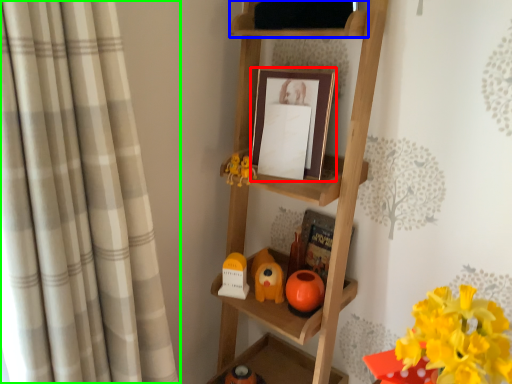
Question: Estimate the real-world distances between objects in this image. Which object is closer to picture frame (highlighted by a red box), shelf (highlighted by a blue box) or curtain (highlighted by a green box)?

Choices:
 (A) shelf
 (B) curtain

Answer: (A)